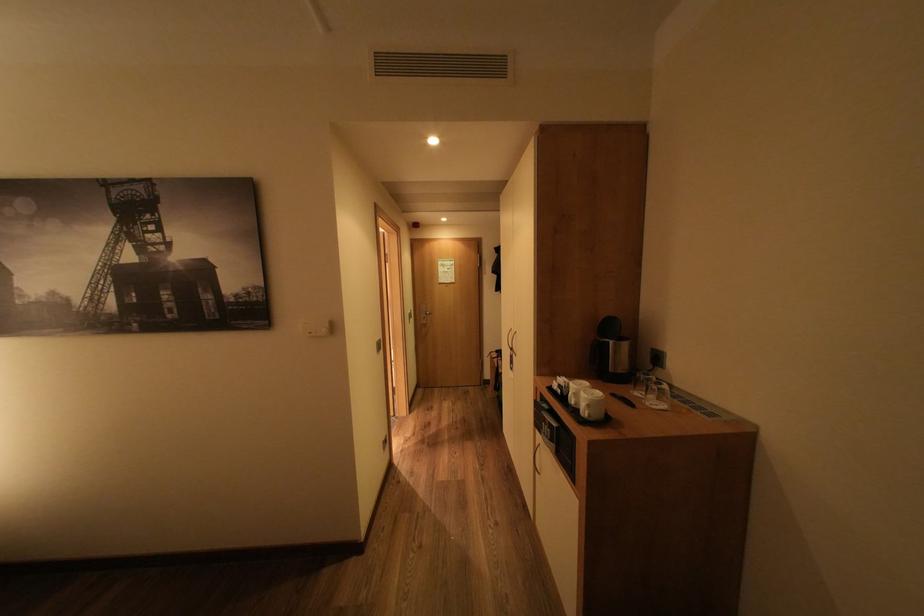
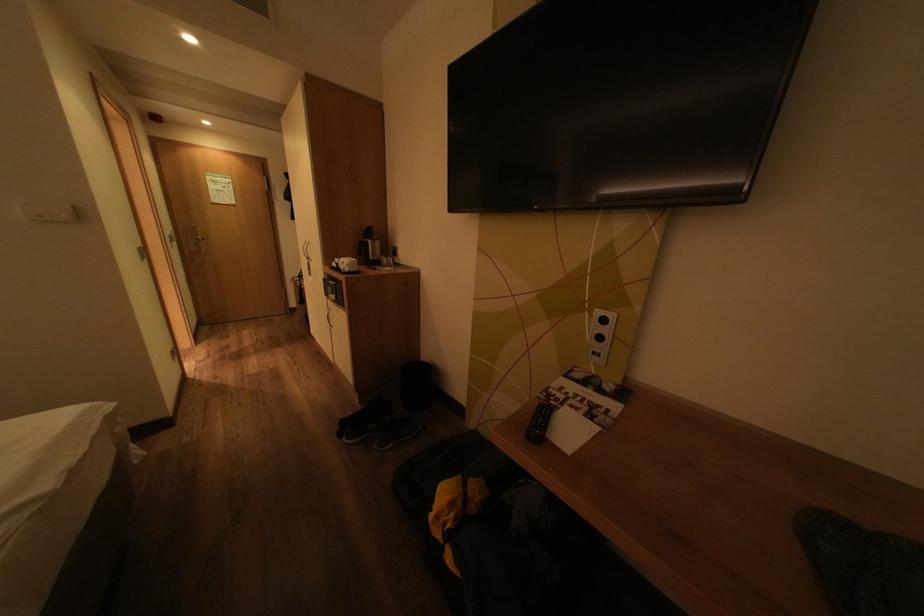
Question: The images are taken continuously from a first-person perspective. In which direction is your viewpoint rotating?

Choices:
 (A) Left
 (B) Right
 (C) Up
 (D) Down

Answer: (B)